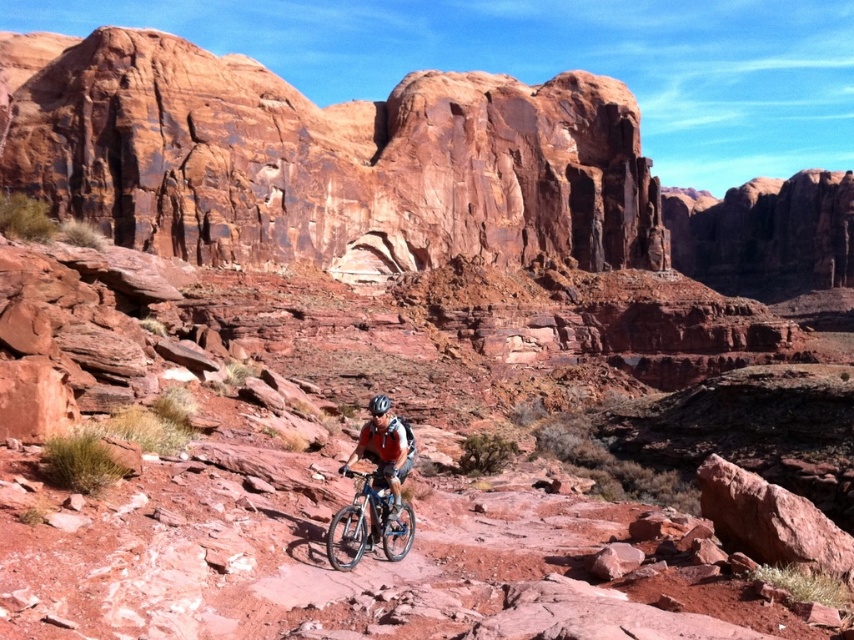
You are a photographer planning to take a wide shot of the rustic sandstone rock formation at center and the matte orange shirt at center. Which object should you focus on first if you want to highlight the larger subject in your photo?

The rustic sandstone rock formation at center is bigger than the matte orange shirt at center, so you should focus on the rustic sandstone rock formation at center first to highlight the larger subject.

You are a photographer aiming to capture the matte orange shirt at center while ensuring the rustic sandstone rock formation at center is visible in the background. Can you frame the shot so that both are in the same view?

The rustic sandstone rock formation at center is positioned over the matte orange shirt at center, meaning the rock formation will naturally be in the background of the matte orange shirt at center. Therefore, framing the shot to include the matte orange shirt at center will automatically show the rustic sandstone rock formation at center behind it, achieving your goal.

You are a mountain biker on a trail in the desert canyon. There is a rustic sandstone rock formation at center. Can you see the point at coordinates (323, 157) from your current position?

The rustic sandstone rock formation at center is represented by point (323, 157), so yes, you can see the point at coordinates (323, 157) from your current position because it corresponds to the rock formation you can see.